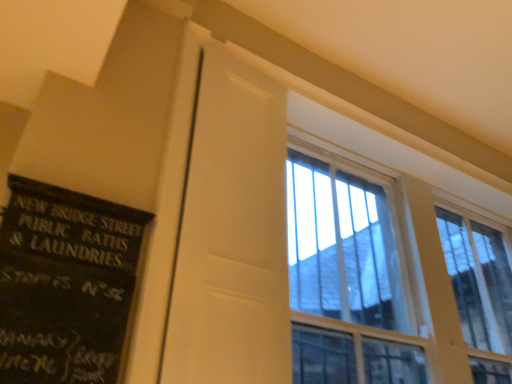
Measure the distance between clear glass window at upper right and camera.

clear glass window at upper right is 6.48 feet away from camera.

This screenshot has height=384, width=512. I want to click on white matte door at center, so click(x=231, y=235).

From the image's perspective, which is below, clear glass window at upper right or white matte door at center?

clear glass window at upper right.

Is clear glass window at upper right positioned with its back to white matte door at center?

No.

Is point (329, 185) farther from camera compared to point (209, 337)?

Yes, point (329, 185) is behind point (209, 337).

Is clear glass window at upper right bigger than white matte door at center?

Yes.

How many degrees apart are the facing directions of clear glass window at upper right and black painted wood signboard at left?

1.47 degrees.

Is point (357, 197) behind point (22, 190)?

Yes, it is.

Can you confirm if clear glass window at upper right is positioned to the right of black painted wood signboard at left?

Yes, clear glass window at upper right is to the right of black painted wood signboard at left.

In the image, there is a clear glass window at upper right. In order to click on bulletin board below it (from a real-world perspective) in this screenshot , I will do `click(65, 284)`.

From a real-world perspective, is black painted wood signboard at left physically below white matte door at center?

Yes.

Is black painted wood signboard at left at the right side of white matte door at center?

No.

From the picture: Is black painted wood signboard at left in contact with white matte door at center?

They are not placed beside each other.

Is point (81, 340) less distant than point (237, 276)?

Yes, it is.

What's the angular difference between white matte door at center and clear glass window at upper right's facing directions?

0.00117 degrees separate the facing orientations of white matte door at center and clear glass window at upper right.

Is white matte door at center placed right next to clear glass window at upper right?

No, white matte door at center is not touching clear glass window at upper right.

From a real-world perspective, between white matte door at center and clear glass window at upper right, who is vertically lower?

white matte door at center is physically lower.

In the image, is white matte door at center positioned in front of or behind clear glass window at upper right?

Visually, white matte door at center is located in front of clear glass window at upper right.

Would you say black painted wood signboard at left is to the left or to the right of clear glass window at upper right in the picture?

In the image, black painted wood signboard at left appears on the left side of clear glass window at upper right.

Is black painted wood signboard at left not close to clear glass window at upper right?

Yes, black painted wood signboard at left is far from clear glass window at upper right.

What's the angular difference between black painted wood signboard at left and clear glass window at upper right's facing directions?

There is a 1.47-degree angle between the facing directions of black painted wood signboard at left and clear glass window at upper right.

Is white matte door at center to the left of black painted wood signboard at left from the viewer's perspective?

No.

Is white matte door at center taller or shorter than black painted wood signboard at left?

Considering their sizes, white matte door at center has more height than black painted wood signboard at left.

Locate an element on the screen. The width and height of the screenshot is (512, 384). window on the right side of white matte door at center is located at coordinates (390, 279).

Find the location of `window lying behind the black painted wood signboard at left`. window lying behind the black painted wood signboard at left is located at coordinates (390, 279).

Estimate the real-world distances between objects in this image. Which object is further from white matte door at center, black painted wood signboard at left or clear glass window at upper right?

Based on the image, clear glass window at upper right appears to be further to white matte door at center.

Considering their positions, is white matte door at center positioned further to black painted wood signboard at left than clear glass window at upper right?

clear glass window at upper right lies further to black painted wood signboard at left than the other object.

From the picture: Considering their positions, is white matte door at center positioned further to clear glass window at upper right than black painted wood signboard at left?

The object further to clear glass window at upper right is black painted wood signboard at left.

Considering their positions, is clear glass window at upper right positioned closer to white matte door at center than black painted wood signboard at left?

Based on the image, black painted wood signboard at left appears to be nearer to white matte door at center.

When comparing their distances from clear glass window at upper right, does black painted wood signboard at left or white matte door at center seem closer?

The object closer to clear glass window at upper right is white matte door at center.

Looking at the image, which one is located further to black painted wood signboard at left, clear glass window at upper right or white matte door at center?

The object further to black painted wood signboard at left is clear glass window at upper right.

You are a GUI agent. You are given a task and a screenshot of the screen. Output one action in this format:
    pyautogui.click(x=<x>, y=<y>)
    Task: Click on the screen door between black painted wood signboard at left and clear glass window at upper right
    
    Given the screenshot: What is the action you would take?
    pyautogui.click(x=231, y=235)